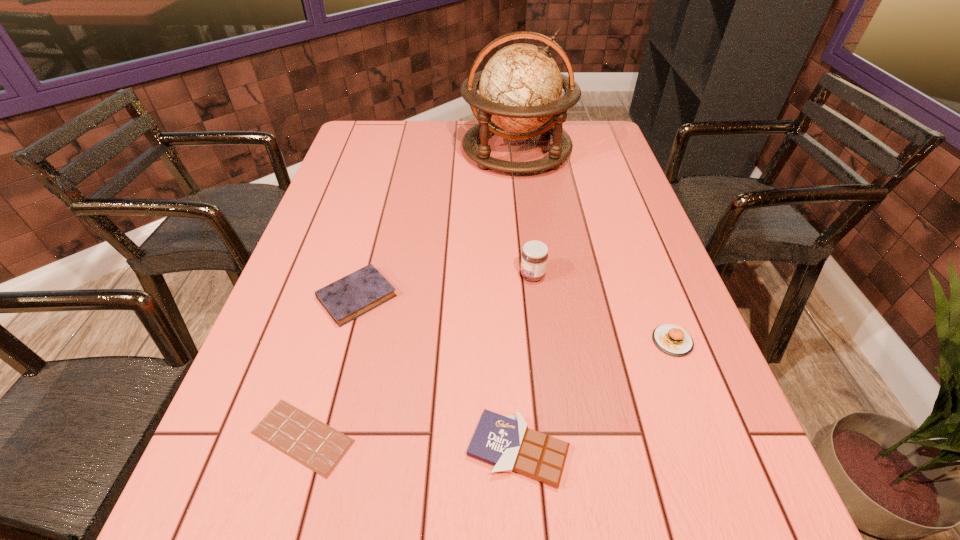
The image size is (960, 540). I want to click on the tallest object, so click(520, 88).

Identify the location of the farthest object. The image size is (960, 540). (520, 88).

Where is `jam`? The image size is (960, 540). jam is located at coordinates (534, 258).

Identify the location of food. (671, 339).

Find the location of a particular element. the taller chocolate bar is located at coordinates (506, 442).

Identify the location of diary. (348, 298).

Locate an element on the screen. The height and width of the screenshot is (540, 960). the shorter chocolate bar is located at coordinates (319, 447).

The width and height of the screenshot is (960, 540). What are the coordinates of `the left chocolate bar` in the screenshot? It's located at (319, 447).

Find the location of `vacant space located 0.200m on the front of the tallest object`. vacant space located 0.200m on the front of the tallest object is located at coordinates 525,220.

Locate an element on the screen. This screenshot has height=540, width=960. blank area located on the front label of the second tallest object is located at coordinates (421, 275).